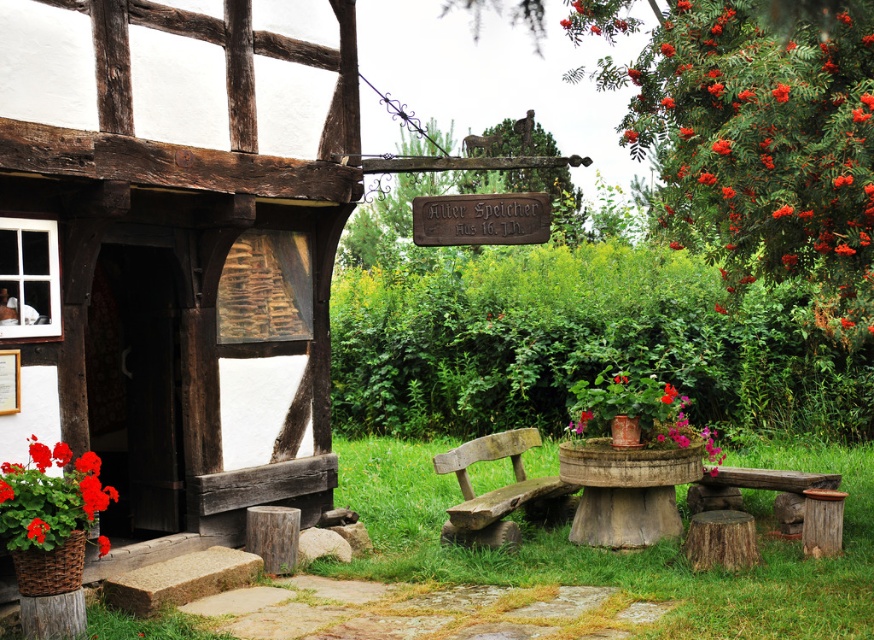
You are an artist planning to paint the Aller Speicher Haus. You notice the red berries at upper right and the rustic wooden bench at lower right. Which object would you need to paint a wider brush stroke for, considering their widths?

The red berries at upper right require a wider brush stroke because their width is greater than that of the rustic wooden bench at lower right.

You are a gardener who wants to place a new plant that is 12 inches wide between the bright red geranium in woven basket at lower left and the red matte flower at lower left. Based on the scene, will the plant fit between them?

The distance between the bright red geranium in woven basket at lower left and the red matte flower at lower left is 10.10 inches. Since the new plant is 12 inches wide, it won not fit between them as the space is smaller than the plant.